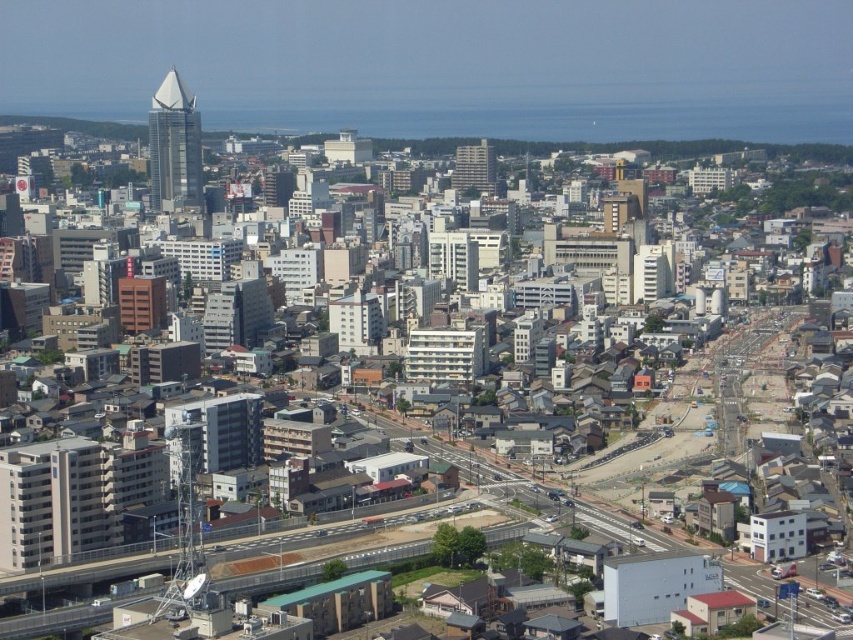
Consider the image. Who is positioned more to the left, shiny glass skyscraper at upper left or matte glass spire at upper left?

matte glass spire at upper left is more to the left.

This screenshot has width=853, height=640. I want to click on shiny glass skyscraper at upper left, so click(x=173, y=145).

What are the coordinates of `shiny glass skyscraper at upper left` in the screenshot? It's located at (173, 145).